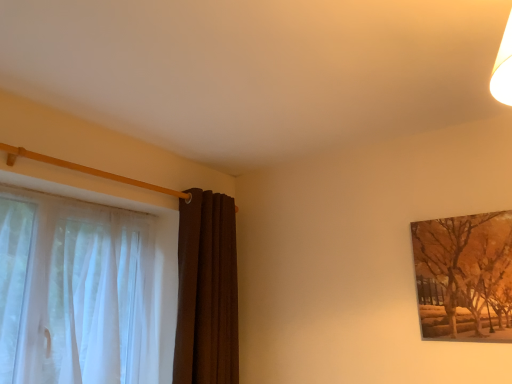
Question: Does point (58, 316) appear closer or farther from the camera than point (201, 345)?

Choices:
 (A) closer
 (B) farther

Answer: (A)

Question: Is sheer white curtain at left, the second curtain when ordered from right to left, bigger or smaller than brown velvet curtain at left, the first curtain positioned from the right?

Choices:
 (A) small
 (B) big

Answer: (B)

Question: Based on their relative distances, which object is farther from the brown textured painting at upper right?

Choices:
 (A) sheer white curtain at left, positioned as the first curtain in left-to-right order
 (B) brown velvet curtain at left, positioned as the 2th curtain in left-to-right order

Answer: (A)

Question: Which object is the closest to the brown textured painting at upper right?

Choices:
 (A) brown velvet curtain at left, positioned as the 2th curtain in left-to-right order
 (B) sheer white curtain at left, the second curtain when ordered from right to left

Answer: (A)